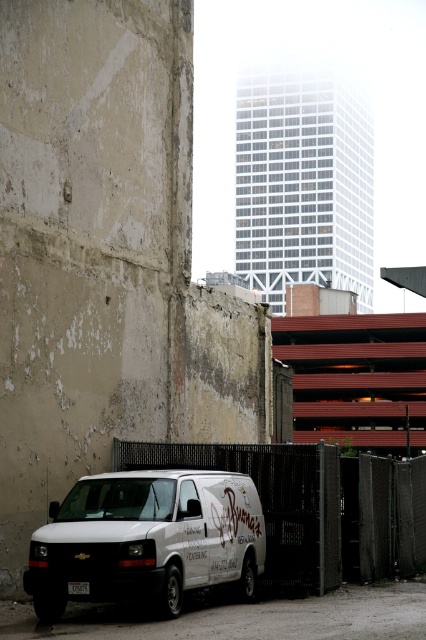
Question: Which object is farther from the camera taking this photo?

Choices:
 (A) metallic chain-link fence at lower center
 (B) white matte van at lower left

Answer: (A)

Question: Is white matte van at lower left wider than metallic chain-link fence at lower center?

Choices:
 (A) yes
 (B) no

Answer: (B)

Question: Which of the following is the farthest from the observer?

Choices:
 (A) (123, 515)
 (B) (365, 522)

Answer: (B)

Question: Is white matte van at lower left below metallic chain-link fence at lower center?

Choices:
 (A) no
 (B) yes

Answer: (B)

Question: Does white matte van at lower left appear over metallic chain-link fence at lower center?

Choices:
 (A) no
 (B) yes

Answer: (A)